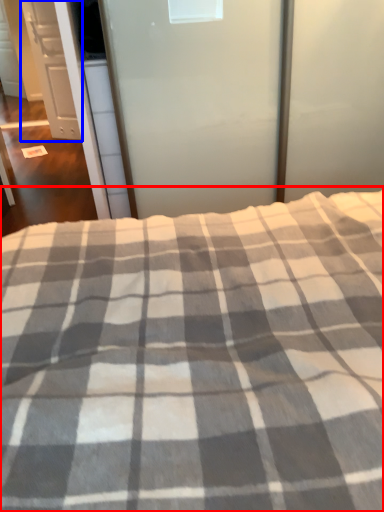
Question: Which of the following is the closest to the observer, bed (highlighted by a red box) or cabinetry (highlighted by a blue box)?

Choices:
 (A) bed
 (B) cabinetry

Answer: (A)